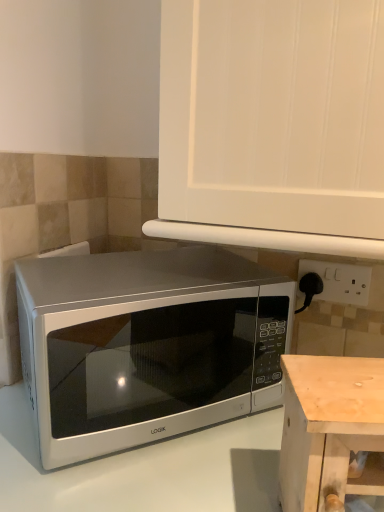
Question: Should I look upward or downward to see white plastic electric outlet at right?

Choices:
 (A) down
 (B) up

Answer: (A)

Question: Can you confirm if pine wood table at lower right is thinner than satin silver microwave at center?

Choices:
 (A) yes
 (B) no

Answer: (A)

Question: Considering the relative positions of pine wood table at lower right and satin silver microwave at center in the image provided, is pine wood table at lower right behind satin silver microwave at center?

Choices:
 (A) no
 (B) yes

Answer: (A)

Question: From the image's perspective, is pine wood table at lower right on satin silver microwave at center?

Choices:
 (A) yes
 (B) no

Answer: (B)

Question: Is pine wood table at lower right touching satin silver microwave at center?

Choices:
 (A) yes
 (B) no

Answer: (B)

Question: Is pine wood table at lower right bigger than satin silver microwave at center?

Choices:
 (A) no
 (B) yes

Answer: (A)

Question: Does pine wood table at lower right have a greater height compared to satin silver microwave at center?

Choices:
 (A) yes
 (B) no

Answer: (B)

Question: From the image's perspective, is white glossy microwave at lower left above white plastic electric outlet at right?

Choices:
 (A) no
 (B) yes

Answer: (A)

Question: Considering the relative sizes of white glossy microwave at lower left and white plastic electric outlet at right in the image provided, is white glossy microwave at lower left shorter than white plastic electric outlet at right?

Choices:
 (A) yes
 (B) no

Answer: (B)

Question: Could you tell me if white glossy microwave at lower left is turned towards white plastic electric outlet at right?

Choices:
 (A) yes
 (B) no

Answer: (B)

Question: Considering the relative positions of white glossy microwave at lower left and white plastic electric outlet at right in the image provided, is white glossy microwave at lower left in front of white plastic electric outlet at right?

Choices:
 (A) no
 (B) yes

Answer: (B)

Question: Considering the relative sizes of white glossy microwave at lower left and white plastic electric outlet at right in the image provided, is white glossy microwave at lower left taller than white plastic electric outlet at right?

Choices:
 (A) no
 (B) yes

Answer: (B)

Question: From a real-world perspective, is white glossy microwave at lower left physically below white plastic electric outlet at right?

Choices:
 (A) no
 (B) yes

Answer: (B)

Question: From a real-world perspective, is white plastic electric outlet at right positioned over pine wood table at lower right based on gravity?

Choices:
 (A) yes
 (B) no

Answer: (A)